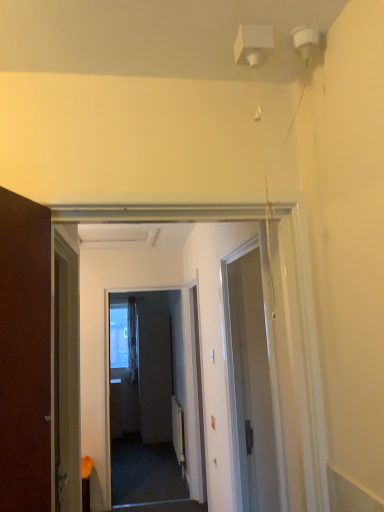
Question: Can you confirm if white sheer curtain at center is thinner than white glossy door at center?

Choices:
 (A) no
 (B) yes

Answer: (A)

Question: Would you consider white sheer curtain at center to be distant from white glossy door at center?

Choices:
 (A) no
 (B) yes

Answer: (B)

Question: Is the depth of white sheer curtain at center greater than that of white glossy door at center?

Choices:
 (A) no
 (B) yes

Answer: (B)

Question: Is white sheer curtain at center taller than white glossy door at center?

Choices:
 (A) no
 (B) yes

Answer: (A)

Question: Is white sheer curtain at center located outside white glossy door at center?

Choices:
 (A) no
 (B) yes

Answer: (B)

Question: Considering the positions of point (150, 407) and point (132, 312), is point (150, 407) closer or farther from the camera than point (132, 312)?

Choices:
 (A) farther
 (B) closer

Answer: (B)

Question: From the image's perspective, relative to white sheer curtain at center, is matte gray screen door at center above or below?

Choices:
 (A) below
 (B) above

Answer: (A)

Question: Considering the relative positions of matte gray screen door at center and white sheer curtain at center in the image provided, is matte gray screen door at center to the left or to the right of white sheer curtain at center?

Choices:
 (A) right
 (B) left

Answer: (A)

Question: In the image, is matte gray screen door at center positioned in front of or behind white sheer curtain at center?

Choices:
 (A) front
 (B) behind

Answer: (A)

Question: From the image's perspective, relative to matte gray screen door at center, is white glossy door at center above or below?

Choices:
 (A) below
 (B) above

Answer: (B)

Question: Choose the correct answer: Is white glossy door at center inside matte gray screen door at center or outside it?

Choices:
 (A) inside
 (B) outside

Answer: (B)

Question: Is white glossy door at center taller or shorter than matte gray screen door at center?

Choices:
 (A) short
 (B) tall

Answer: (A)

Question: Considering the positions of point (235, 280) and point (157, 361), is point (235, 280) closer or farther from the camera than point (157, 361)?

Choices:
 (A) closer
 (B) farther

Answer: (A)

Question: From a real-world perspective, is white sheer curtain at center above or below matte gray screen door at center?

Choices:
 (A) above
 (B) below

Answer: (A)

Question: Would you say white sheer curtain at center is to the left or to the right of matte gray screen door at center in the picture?

Choices:
 (A) left
 (B) right

Answer: (A)